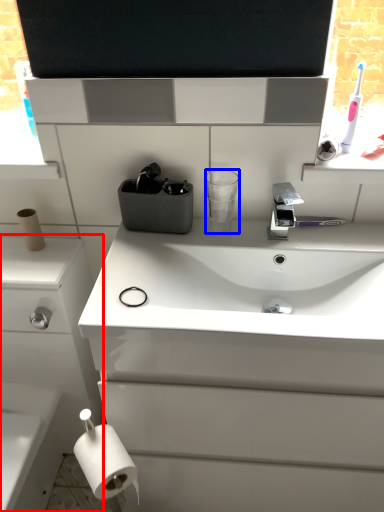
Question: Which point is closer to the camera, bathroom cabinet (highlighted by a red box) or cup (highlighted by a blue box)?

Choices:
 (A) bathroom cabinet
 (B) cup

Answer: (A)